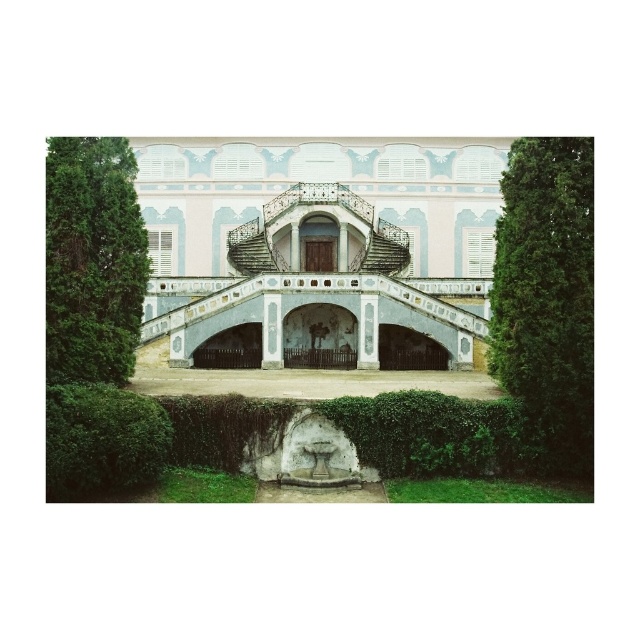
Can you confirm if pastel painted palace at center is wider than green leafy hedge at right?

Yes, pastel painted palace at center is wider than green leafy hedge at right.

Is point (264, 246) positioned behind point (582, 211)?

That is True.

At what (x,y) coordinates should I click in order to perform the action: click on pastel painted palace at center. Please return your answer as a coordinate pair (x, y). Looking at the image, I should click on (317, 236).

Which is more to the right, green leafy hedge at right or green leafy hedge at lower left?

From the viewer's perspective, green leafy hedge at right appears more on the right side.

Who is lower down, green leafy hedge at right or green leafy hedge at lower left?

green leafy hedge at lower left

Locate an element on the screen. green leafy hedge at right is located at coordinates (547, 296).

Where is `green leafy hedge at right`? The image size is (640, 640). green leafy hedge at right is located at coordinates (547, 296).

Who is lower down, pastel painted palace at center or green leafy hedge at left?

Positioned lower is green leafy hedge at left.

Locate an element on the screen. pastel painted palace at center is located at coordinates point(317,236).